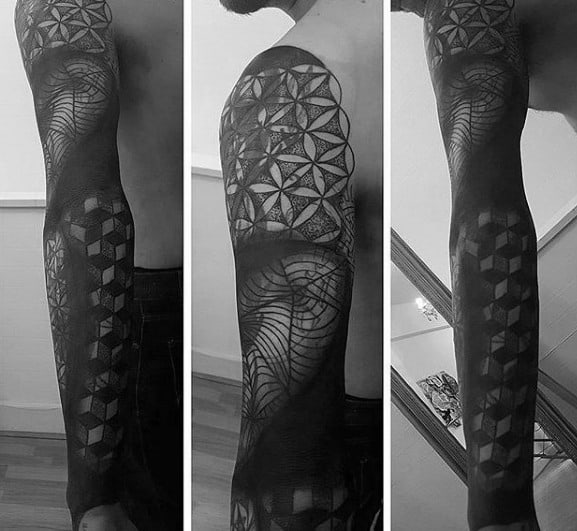
Locate an element on the screen. The width and height of the screenshot is (577, 531). floor is located at coordinates (218, 408), (40, 462).